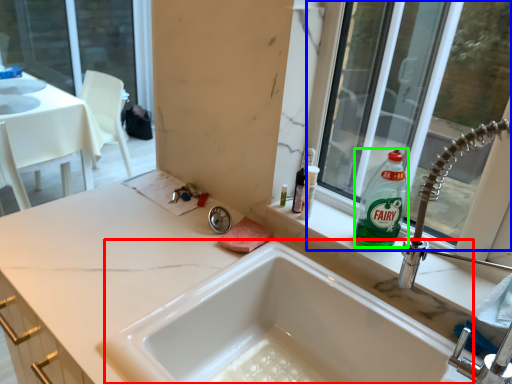
Question: Which is farther away from tub (highlighted by a red box)? window (highlighted by a blue box) or cleaning product (highlighted by a green box)?

Choices:
 (A) window
 (B) cleaning product

Answer: (A)